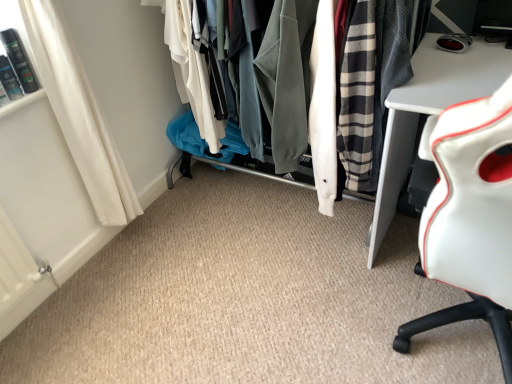
Question: Is white leather chair at right completely or partially inside textured fabric clothes at center?

Choices:
 (A) no
 (B) yes

Answer: (A)

Question: Does textured fabric clothes at center have a greater width compared to white leather chair at right?

Choices:
 (A) no
 (B) yes

Answer: (A)

Question: Can you confirm if textured fabric clothes at center is shorter than white leather chair at right?

Choices:
 (A) yes
 (B) no

Answer: (A)

Question: Is textured fabric clothes at center thinner than white leather chair at right?

Choices:
 (A) no
 (B) yes

Answer: (B)

Question: Is textured fabric clothes at center outside white leather chair at right?

Choices:
 (A) no
 (B) yes

Answer: (B)

Question: From a real-world perspective, is white fabric curtain at lower left positioned above or below white leather chair at right?

Choices:
 (A) above
 (B) below

Answer: (A)

Question: Would you say white fabric curtain at lower left is to the left or to the right of white leather chair at right in the picture?

Choices:
 (A) right
 (B) left

Answer: (B)

Question: In terms of size, does white fabric curtain at lower left appear bigger or smaller than white leather chair at right?

Choices:
 (A) big
 (B) small

Answer: (B)

Question: From the image's perspective, is white fabric curtain at lower left above or below white leather chair at right?

Choices:
 (A) above
 (B) below

Answer: (A)

Question: Considering the positions of textured fabric clothes at center and white fabric curtain at lower left in the image, is textured fabric clothes at center bigger or smaller than white fabric curtain at lower left?

Choices:
 (A) big
 (B) small

Answer: (A)

Question: From a real-world perspective, is textured fabric clothes at center positioned above or below white fabric curtain at lower left?

Choices:
 (A) below
 (B) above

Answer: (A)

Question: Do you think textured fabric clothes at center is within white fabric curtain at lower left, or outside of it?

Choices:
 (A) outside
 (B) inside

Answer: (A)

Question: Based on their positions, is textured fabric clothes at center located to the left or right of white fabric curtain at lower left?

Choices:
 (A) right
 (B) left

Answer: (A)

Question: From the image's perspective, relative to white leather chair at right, is textured fabric clothes at center above or below?

Choices:
 (A) above
 (B) below

Answer: (A)

Question: Is point (339, 147) closer or farther from the camera than point (439, 177)?

Choices:
 (A) closer
 (B) farther

Answer: (B)